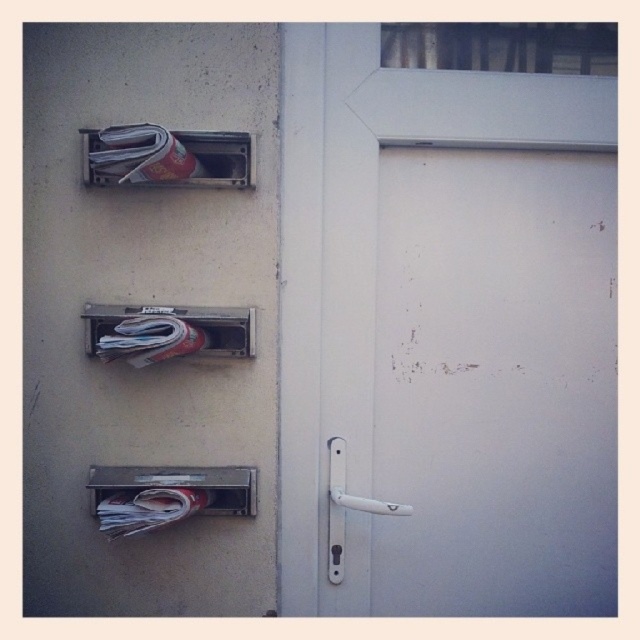
Question: Considering the real-world distances, which object is farthest from the metallic newspaper at upper left?

Choices:
 (A) white matte door at center
 (B) metallic newspaper at center
 (C) white plastic door handle at center

Answer: (C)

Question: Which object is closer to the camera taking this photo?

Choices:
 (A) metallic newspaper at upper left
 (B) metallic newspaper at center
 (C) white plastic door handle at center
 (D) white matte door at center

Answer: (A)

Question: Is metallic newspaper at upper left below white plastic door handle at center?

Choices:
 (A) yes
 (B) no

Answer: (B)

Question: Is metallic newspaper at upper left positioned in front of metallic newspaper at center?

Choices:
 (A) yes
 (B) no

Answer: (A)

Question: Which point is closer to the camera?

Choices:
 (A) tap(221, 346)
 (B) tap(336, 464)
 (C) tap(433, 342)

Answer: (A)

Question: Where is white matte door at center located in relation to metallic newspaper at upper left in the image?

Choices:
 (A) below
 (B) above

Answer: (A)